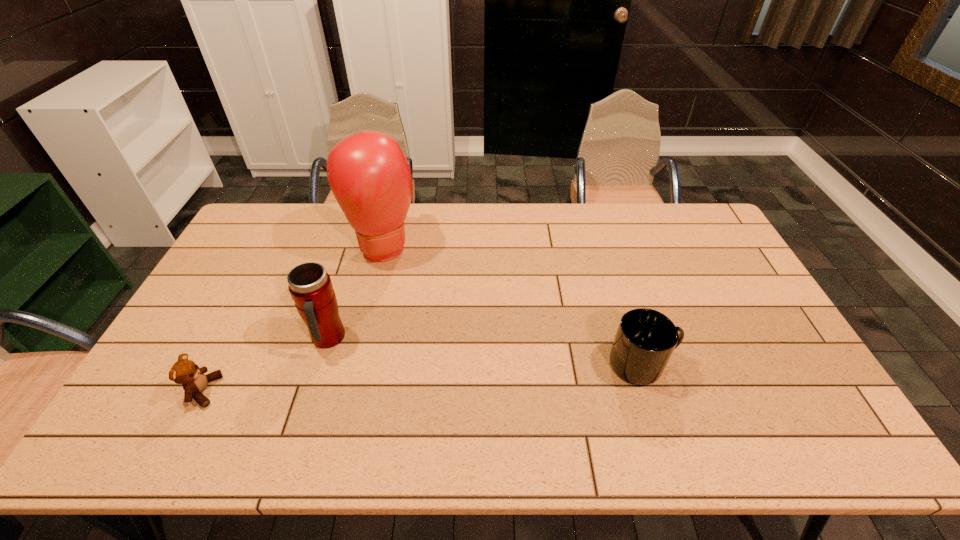
Find the location of a particular element. Image resolution: width=960 pixels, height=540 pixels. the shortest object is located at coordinates (194, 381).

Locate an element on the screen. This screenshot has height=540, width=960. teddy bear is located at coordinates [194, 381].

At what (x,y) coordinates should I click in order to perform the action: click on mug. Please return your answer as a coordinate pair (x, y). Looking at the image, I should click on (645, 339).

Locate an element on the screen. The image size is (960, 540). the second shortest object is located at coordinates (645, 339).

This screenshot has width=960, height=540. What are the coordinates of `the second tallest object` in the screenshot? It's located at (310, 286).

The width and height of the screenshot is (960, 540). Identify the location of the farthest object. (370, 177).

Find the location of a particular element. This screenshot has height=540, width=960. the tallest object is located at coordinates (370, 177).

You are a GUI agent. You are given a task and a screenshot of the screen. Output one action in this format:
    pyautogui.click(x=<x>, y=<y>)
    Task: Click on the free spot located 0.310m on the front-facing side of the shortest object
    This screenshot has width=960, height=540.
    Given the screenshot: What is the action you would take?
    pyautogui.click(x=341, y=391)

The image size is (960, 540). I want to click on vacant space located 0.300m with the handle on the side of the rightmost object, so click(789, 364).

Locate an element on the screen. The image size is (960, 540). free space located on the side with the handle of the second tallest object is located at coordinates point(396,403).